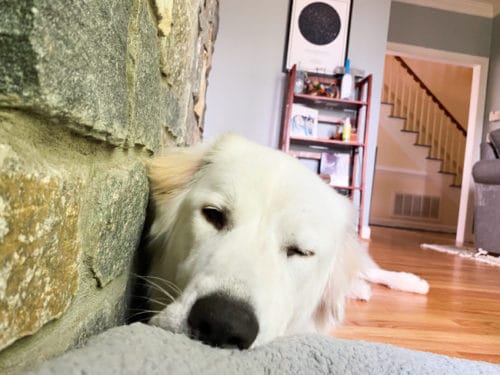
Identify the location of grey rug. The height and width of the screenshot is (375, 500). (326, 352).